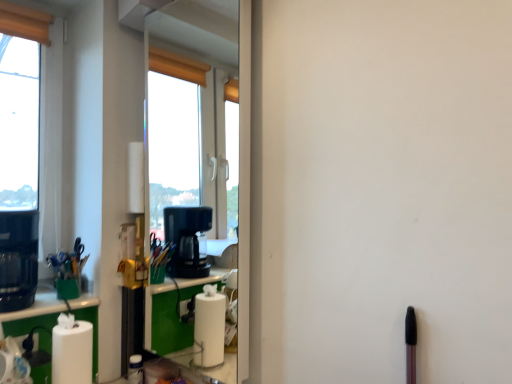
Question: In the image, is white matte paper towel at lower left on the left side or the right side of black plastic coffee machine at left?

Choices:
 (A) left
 (B) right

Answer: (B)

Question: Considering the positions of white matte paper towel at lower left and black plastic coffee machine at left in the image, is white matte paper towel at lower left wider or thinner than black plastic coffee machine at left?

Choices:
 (A) thin
 (B) wide

Answer: (A)

Question: Which of these objects is positioned farthest from the green matte cup at left?

Choices:
 (A) white matte paper towel at lower left
 (B) white matte window at left
 (C) black plastic coffee machine at left

Answer: (B)

Question: Estimate the real-world distances between objects in this image. Which object is closer to the black plastic coffee machine at left?

Choices:
 (A) white matte paper towel at lower left
 (B) white matte window at left
 (C) green matte cup at left

Answer: (C)